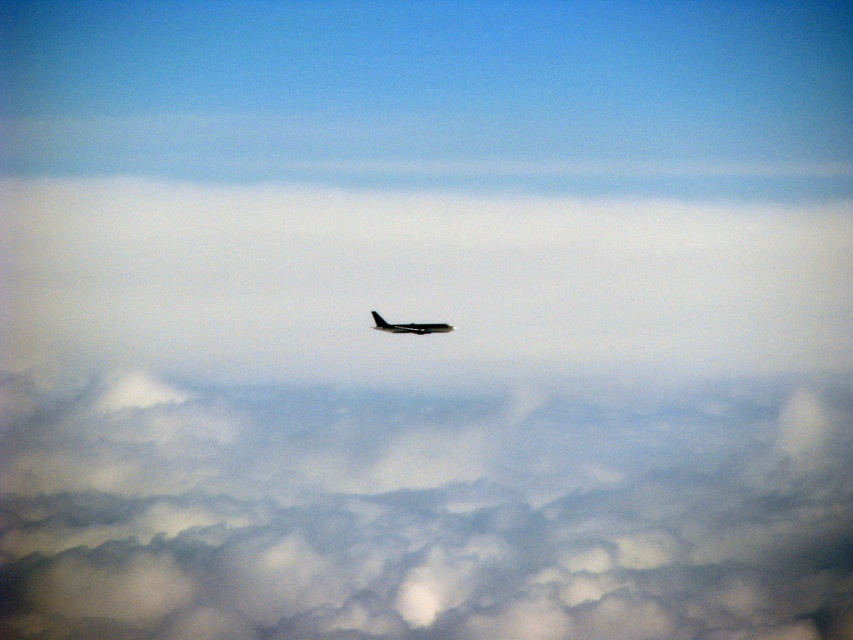
You are a photographer taking an aerial photo of the sky and notice two points in the scene. You want to determine which point is closer to your camera. The points are labeled as point (758,611) and point (424,326). Based on the scene description, which point is closer to the camera?

Point (424,326) is closer to the camera because it is less further than point (758,611).

You are a pilot flying the metallic airplane at center. You need to navigate around the cloudy white at center. Which direction should you adjust your flight path to avoid the clouds?

The cloudy white at center is located below the metallic airplane at center, so you can continue flying straight as the clouds are beneath the plane.